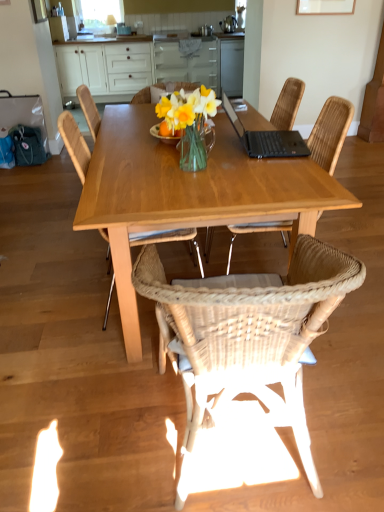
Identify the location of empty space that is in between woven rattan chair at center, which is counted as the 2th chair, starting from the right, and wooden table at center. The image size is (384, 512). (156, 419).